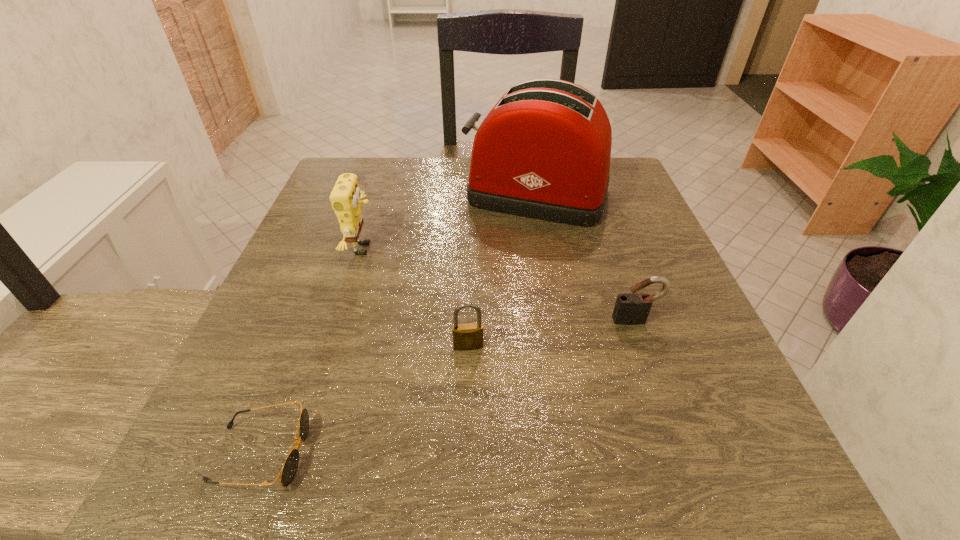
Locate an element on the screen. This screenshot has width=960, height=540. object located at the far right corner is located at coordinates (543, 152).

The width and height of the screenshot is (960, 540). I want to click on free space at the far edge of the desktop, so click(414, 172).

Identify the location of vacant space at the left edge. This screenshot has width=960, height=540. (302, 255).

In the image, there is a desktop. Where is `vacant space at the right edge`? The width and height of the screenshot is (960, 540). vacant space at the right edge is located at coordinates (616, 355).

Locate an element on the screen. vacant area at the far left corner is located at coordinates (363, 182).

Where is `vacant area at the near left corner of the desktop`? The image size is (960, 540). vacant area at the near left corner of the desktop is located at coordinates (178, 495).

I want to click on blank area at the far right corner, so click(615, 160).

Where is `vacant area that lies between the sunglasses and the right padlock`? The image size is (960, 540). vacant area that lies between the sunglasses and the right padlock is located at coordinates (448, 387).

This screenshot has height=540, width=960. In order to click on free space between the toaster and the shortest object in this screenshot , I will do `click(398, 324)`.

Identify the location of vacant region between the right padlock and the fourth shortest object. The height and width of the screenshot is (540, 960). tap(499, 285).